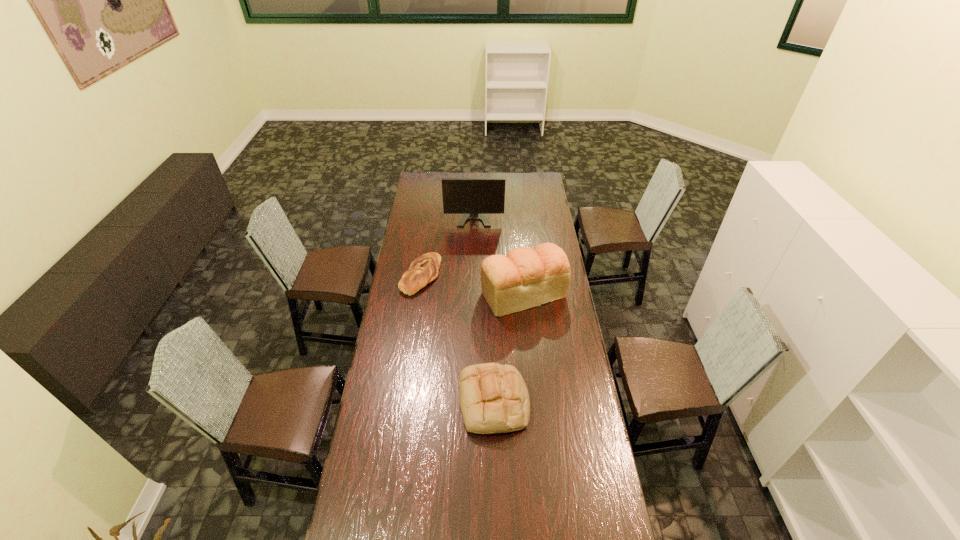
Identify the location of the farthest object. Image resolution: width=960 pixels, height=540 pixels. pos(473,197).

Find the location of `the second tallest object`. the second tallest object is located at coordinates (524, 278).

This screenshot has width=960, height=540. I want to click on the second shortest bread, so click(x=494, y=398).

Locate an element on the screen. Image resolution: width=960 pixels, height=540 pixels. the nearest bread is located at coordinates (494, 398).

Identify the location of the shortest bread. (424, 269).

Find the location of a particular element. The width and height of the screenshot is (960, 540). free space located on the screen side of the computer monitor is located at coordinates (473, 255).

You are a GUI agent. You are given a task and a screenshot of the screen. Output one action in this format:
    pyautogui.click(x=<x>, y=<y>)
    Task: Click on the vacant space located 0.330m on the front of the tallest bread
    The height and width of the screenshot is (540, 960).
    Given the screenshot: What is the action you would take?
    532,378

Where is `free space located on the left of the third tallest object`? The height and width of the screenshot is (540, 960). free space located on the left of the third tallest object is located at coordinates (390, 402).

The width and height of the screenshot is (960, 540). In order to click on blank space located 0.070m on the front of the shortest bread in this screenshot , I will do `click(417, 308)`.

The image size is (960, 540). What are the coordinates of `object located at the far edge` in the screenshot? It's located at (473, 197).